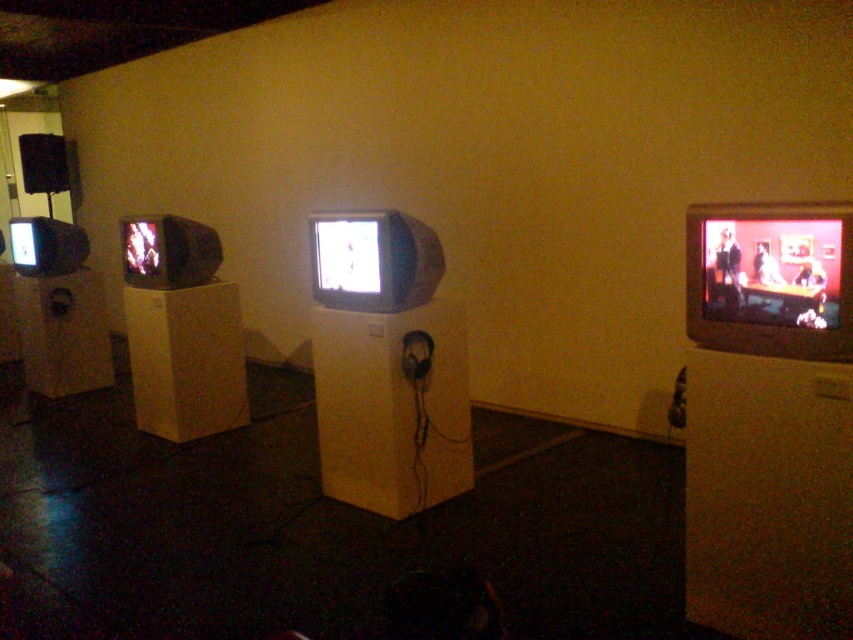
Question: Among these objects, which one is nearest to the camera?

Choices:
 (A) matte black flat screen tv at right
 (B) matte gray crt tv at center

Answer: (A)

Question: Does matte black flat screen tv at right lie behind matte gray crt tv at center?

Choices:
 (A) no
 (B) yes

Answer: (A)

Question: Among these points, which one is nearest to the camera?

Choices:
 (A) (785, 272)
 (B) (427, 280)

Answer: (A)

Question: Is matte black flat screen tv at right closer to the viewer compared to matte gray crt tv at center?

Choices:
 (A) yes
 (B) no

Answer: (A)

Question: Is matte black flat screen tv at right in front of matte gray crt tv at center?

Choices:
 (A) no
 (B) yes

Answer: (B)